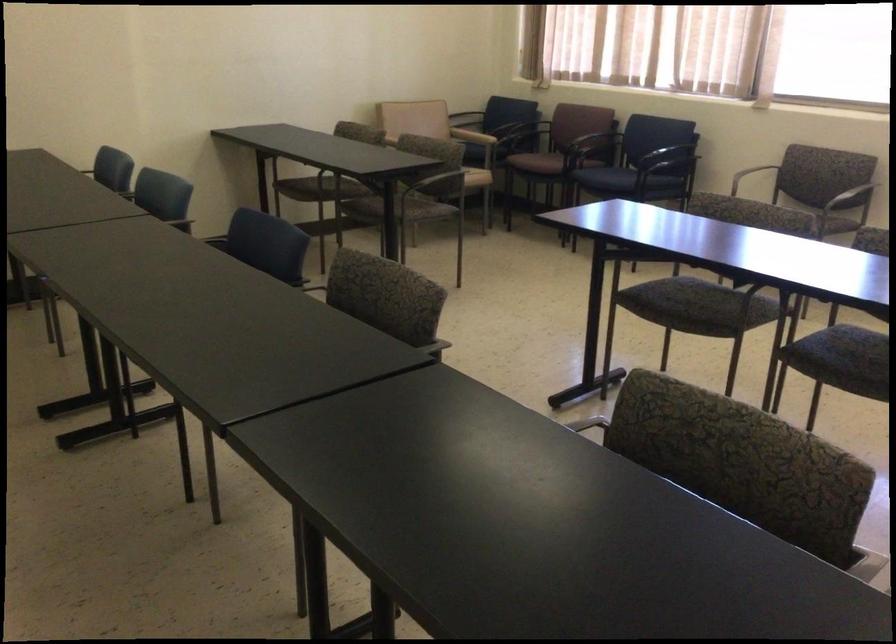
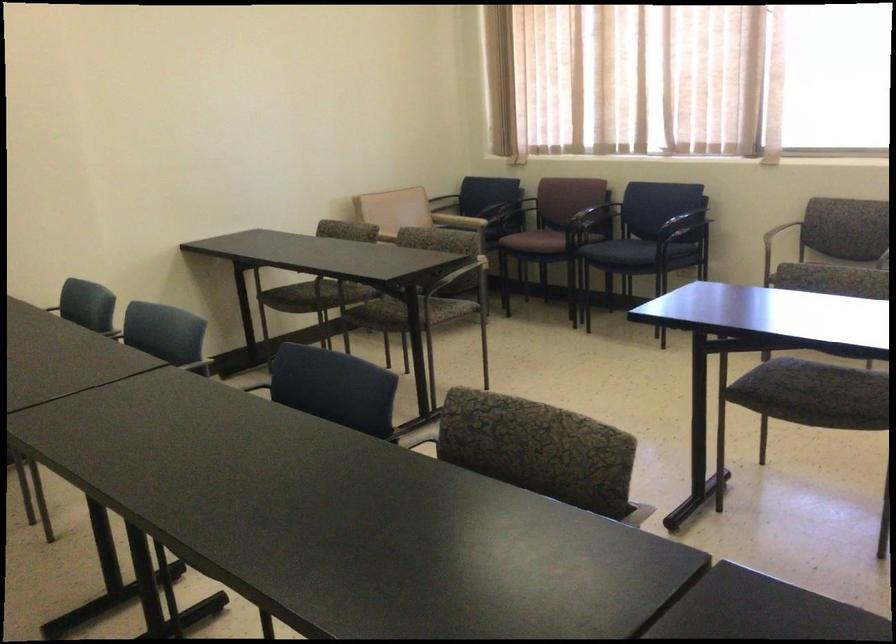
The point at [393,301] is marked in the first image. Where is the corresponding point in the second image?

(538, 449)